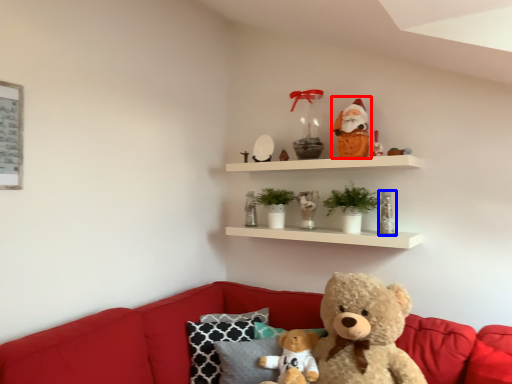
Question: Which of the following is the closest to the observer, santa claus (highlighted by a red box) or toy (highlighted by a blue box)?

Choices:
 (A) santa claus
 (B) toy

Answer: (B)